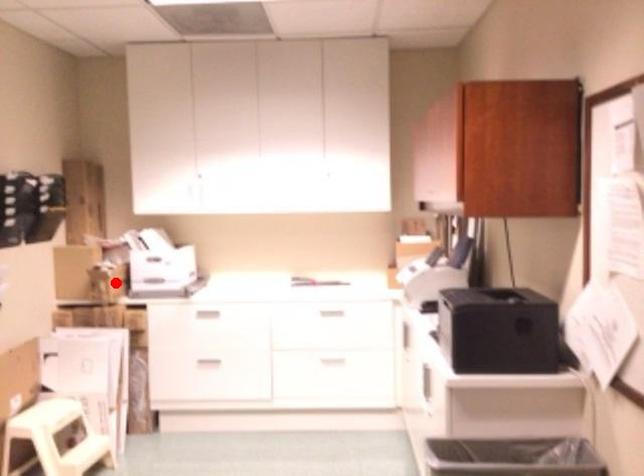
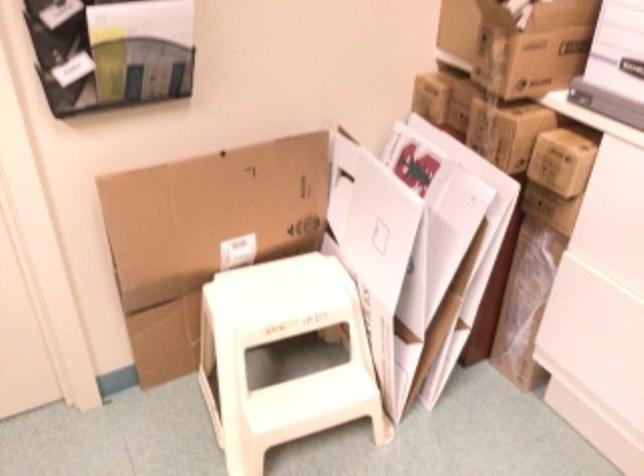
Find the pixel in the second image that matches the highlighted location in the first image.

(532, 46)